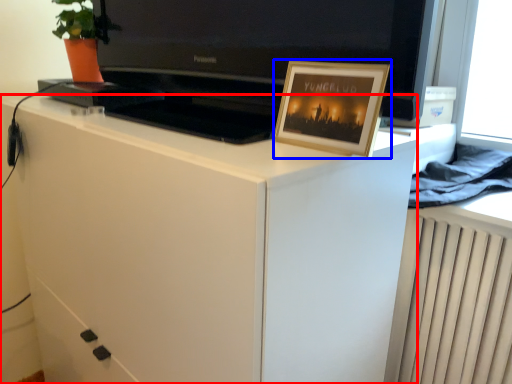
Question: Among these objects, which one is farthest to the camera, cabinetry (highlighted by a red box) or picture frame (highlighted by a blue box)?

Choices:
 (A) cabinetry
 (B) picture frame

Answer: (B)